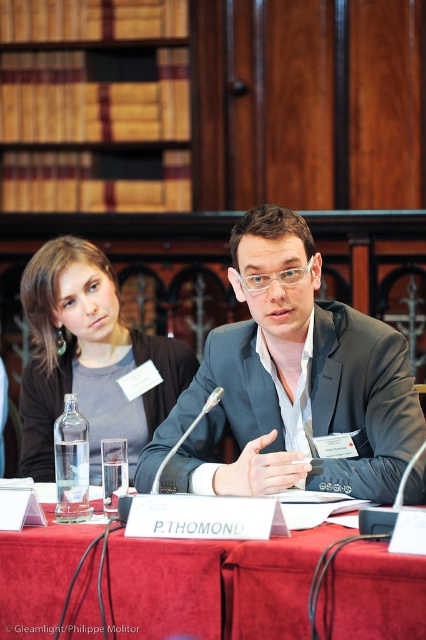
You are an event planner who needs to set up a camera for a live stream. The camera must be placed at least 6 feet away from the speaker to ensure clear audio. Given the current setup with the matte black suit at center, can the camera be positioned as required?

The matte black suit at center and camera are 5.73 feet apart, which is less than the required 6 feet. Therefore, the camera cannot be positioned as required to meet the audio clarity requirement.

You are organizing a formal event and need to ensure that the matte black suit at center is visible to all attendees. Since the red velvet table at center is in the way, can you move the table to make space?

The matte black suit at center is positioned over the red velvet table at center. Since the table is under the suit, you can move the table without affecting the suit as long as you lift the suit first.

You are organizing a small event and need to place a decorative centerpiece on the red velvet table at center. Considering the space available, will the matte black hair at upper left interfere with placing the centerpiece?

The red velvet table at center occupies less space than the matte black hair at upper left, so the matte black hair at upper left may block part of the table, making it difficult to place the centerpiece without obstruction.